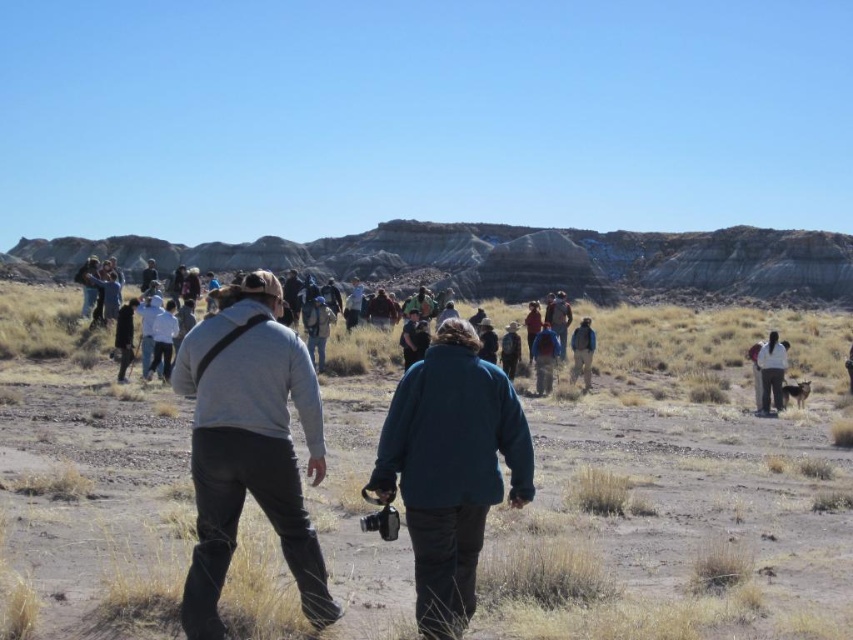
Is gray fleece jacket at center to the right of white fabric jacket at right from the viewer's perspective?

In fact, gray fleece jacket at center is to the left of white fabric jacket at right.

The image size is (853, 640). Find the location of `gray fleece jacket at center`. gray fleece jacket at center is located at coordinates (248, 445).

Locate an element on the screen. Image resolution: width=853 pixels, height=640 pixels. gray fleece jacket at center is located at coordinates (248, 445).

Who is positioned more to the right, dark green fleece jacket at center or light brown leather jacket at center?

dark green fleece jacket at center is more to the right.

In the scene shown: Between dark green fleece jacket at center and light brown leather jacket at center, which one has more height?

dark green fleece jacket at center

Which is in front, point (450, 513) or point (321, 298)?

Positioned in front is point (450, 513).

Identify the location of dark green fleece jacket at center. (450, 468).

Is brown sandy dirt at center shorter than blue denim jacket at center?

No, brown sandy dirt at center is not shorter than blue denim jacket at center.

Is brown sandy dirt at center above blue denim jacket at center?

No.

Is point (589, 595) farther from viewer compared to point (555, 349)?

That is False.

Where is `brown sandy dirt at center`? brown sandy dirt at center is located at coordinates (679, 497).